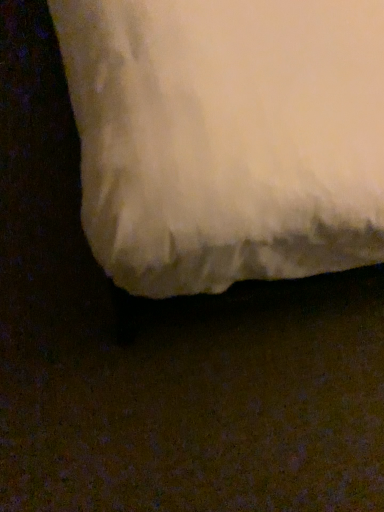
Where is `white soft pillow at lower right`? white soft pillow at lower right is located at coordinates (227, 138).

What do you see at coordinates (227, 138) in the screenshot? I see `white soft pillow at lower right` at bounding box center [227, 138].

Identify the location of white soft pillow at lower right. The image size is (384, 512). (227, 138).